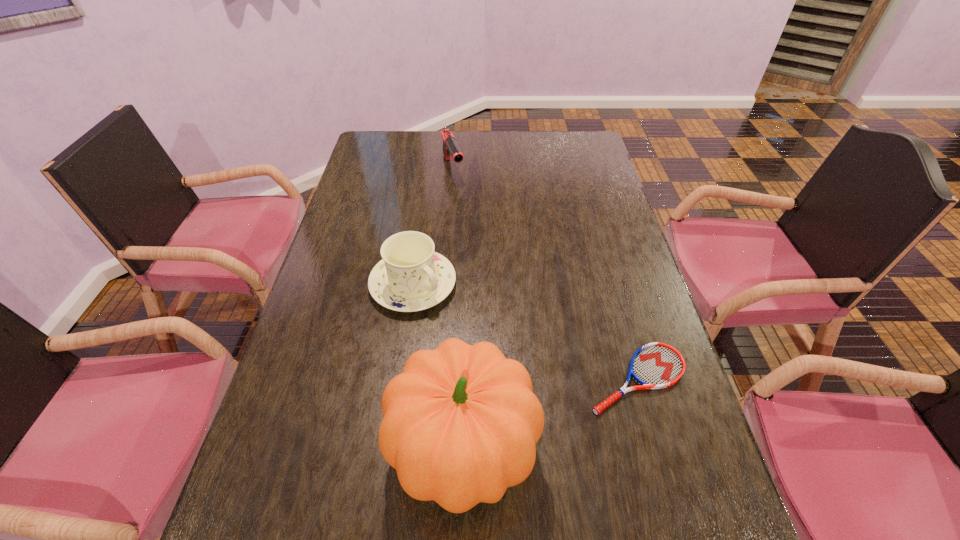
This screenshot has width=960, height=540. What are the coordinates of `vacant area between the pumpkin and the shortest object` in the screenshot? It's located at pyautogui.click(x=550, y=415).

You are a GUI agent. You are given a task and a screenshot of the screen. Output one action in this format:
    pyautogui.click(x=<x>, y=<y>)
    Task: Click on the free area in between the gun and the tennis racket
    The width and height of the screenshot is (960, 540).
    Given the screenshot: What is the action you would take?
    pyautogui.click(x=545, y=274)

What are the coordinates of `the third closest object relative to the chinaware` in the screenshot? It's located at (450, 147).

The height and width of the screenshot is (540, 960). I want to click on object that can be found as the third closest to the farthest object, so click(460, 425).

Where is `vacant space that satisfies the following two spatial constraints: 1. on the front side of the chinaware; 2. on the left side of the pumpkin`? The height and width of the screenshot is (540, 960). vacant space that satisfies the following two spatial constraints: 1. on the front side of the chinaware; 2. on the left side of the pumpkin is located at coordinates point(389,450).

Locate an element on the screen. The image size is (960, 540). vacant area in the image that satisfies the following two spatial constraints: 1. on the front side of the farthest object; 2. on the left side of the pumpkin is located at coordinates (431, 450).